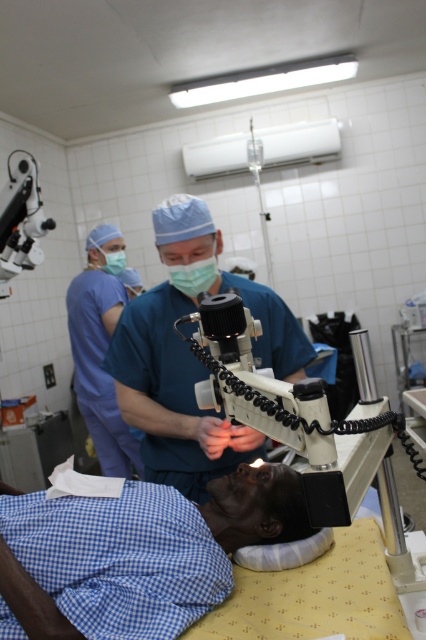
You are a medical student observing an eye surgery in the operating room. You notice two points marked in the scene. The first point is located at coordinates point (351, 451) and the second at point (97, 419). From your perspective as an observer, which point is closer to you?

Point (351, 451) is closer to the camera than point (97, 419), so the first point is closer to you as the observer.

You are a medical student observing an eye surgery. You notice the white plastic microscope at center and the blue scrubs at center. Which object is closer to you?

The white plastic microscope at center is closer to the viewer than the blue scrubs at center.